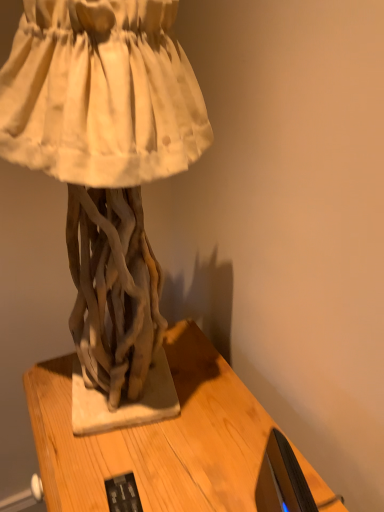
Identify the location of vacant region above wooden table at center (from a real-world perspective). (154, 435).